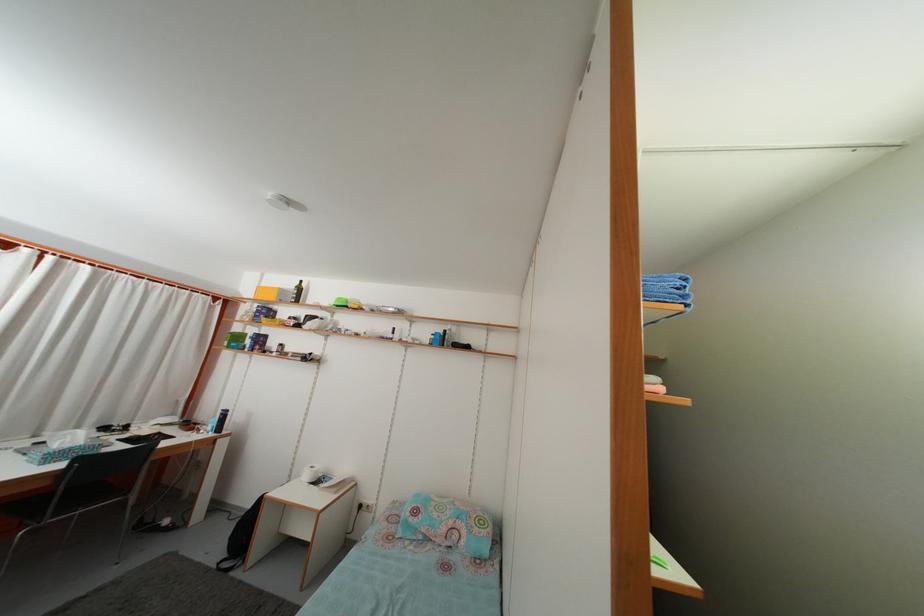
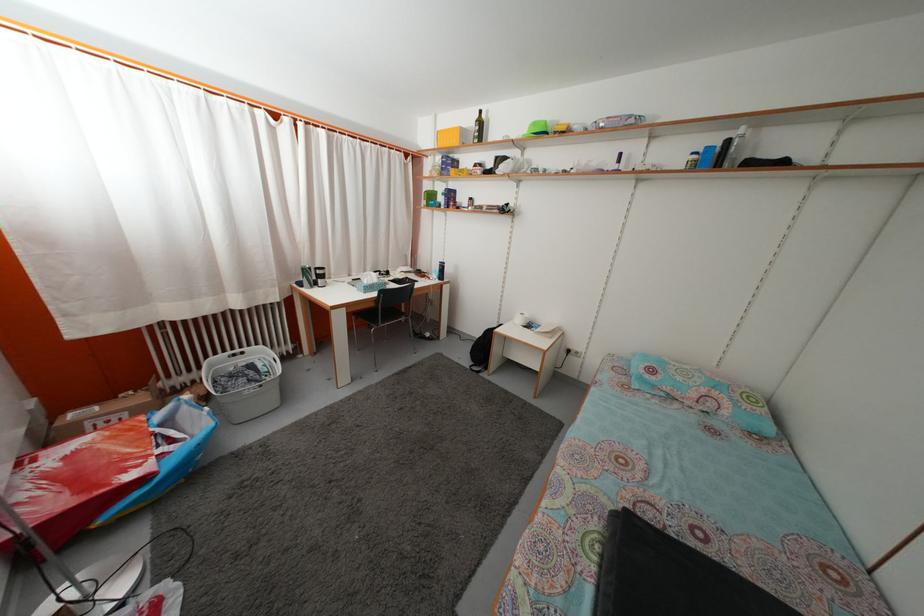
Based on the continuous images, in which direction is the camera rotating?

The rotation direction of the camera is left-down.